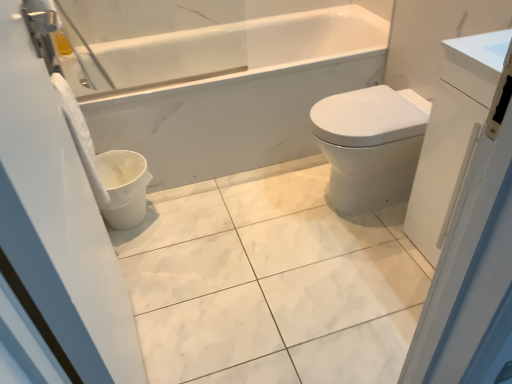
At what (x,y) coordinates should I click in order to perform the action: click on free space that is in between white glossy bidet at right and white glossy toilet bowl at lower left. Please return your answer as a coordinate pair (x, y). This screenshot has height=384, width=512. Looking at the image, I should click on (230, 207).